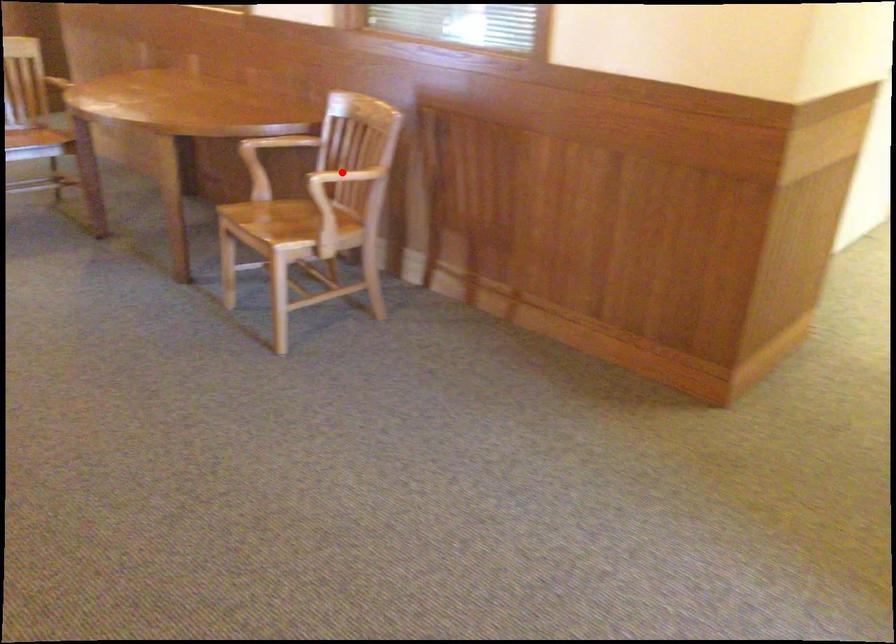
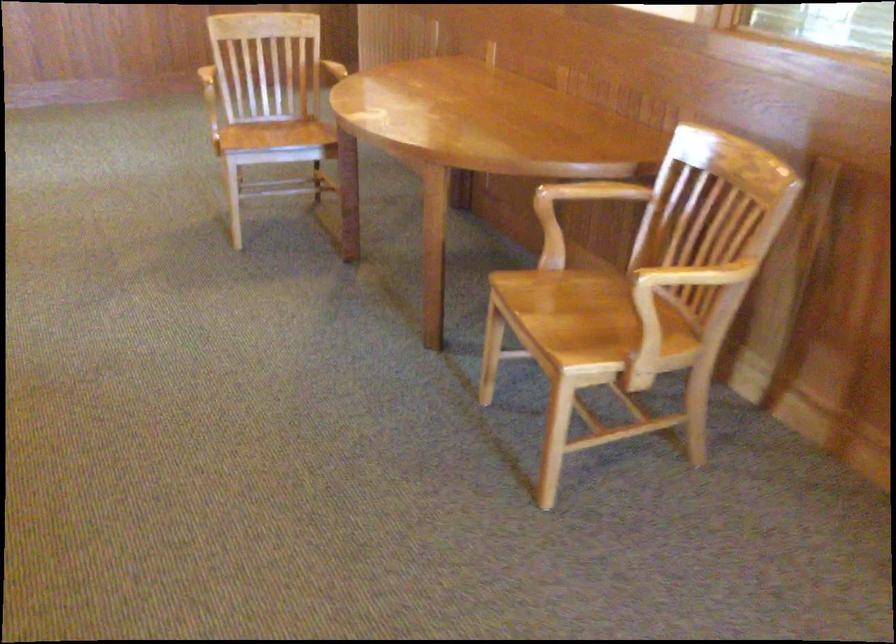
Question: I am providing you with two images of the same scene from different viewpoints. A red point is marked on the first image. Can you still see the location of the red point in image 2?

Choices:
 (A) Yes
 (B) No

Answer: (A)